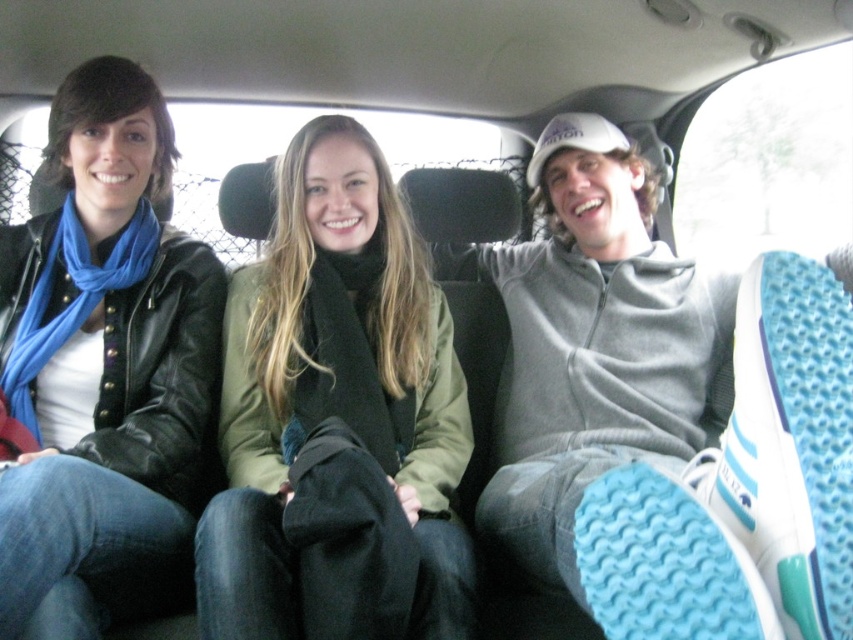
You are taking a photo of two points in a car. The first point is at position point(288, 403) and the second point is at position point(169, 465). Which point is closer to the camera?

Point(288, 403) is further to the camera than point(169, 465), so point(169, 465) is closer to the camera.

You are a photographer trying to capture a closeup shot of both the green matte jacket at center and the matte black jacket at left. Given that your camera can only focus on objects within a 12 inch range, will both jackets be in focus?

The green matte jacket at center and the matte black jacket at left are 11.57 inches apart from each other, which is within the 12 inch range. Therefore, both jackets will be in focus.

You are a photographer trying to capture a candid shot of the two people in the backseat of the car. You want to ensure that the green matte jacket at center and the matte black jacket at left are both visible in the frame. Based on their positions, which jacket is closer to the camera?

The green matte jacket at center is positioned on the right side of the matte black jacket at left, so the green matte jacket at center is closer to the camera than the matte black jacket at left.